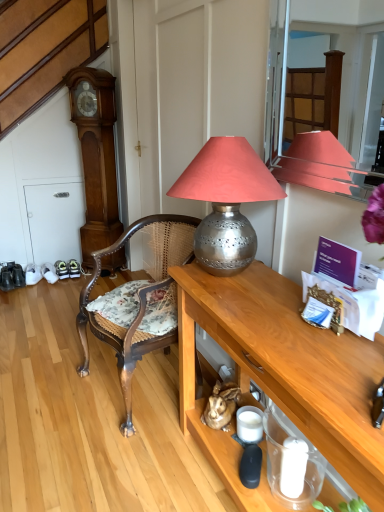
The width and height of the screenshot is (384, 512). Identify the location of free area below silver metallic lampshade at center (from a real-world perspective). (216, 280).